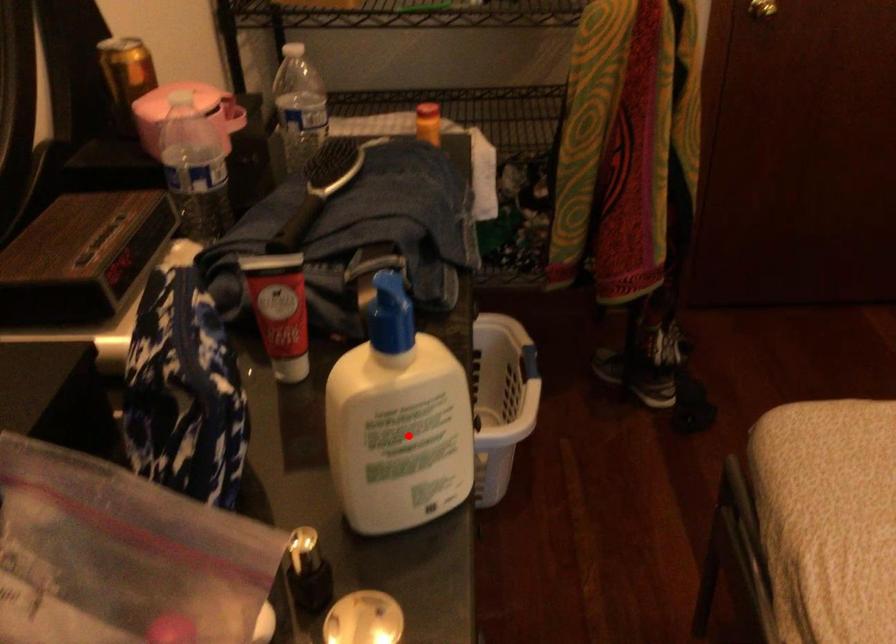
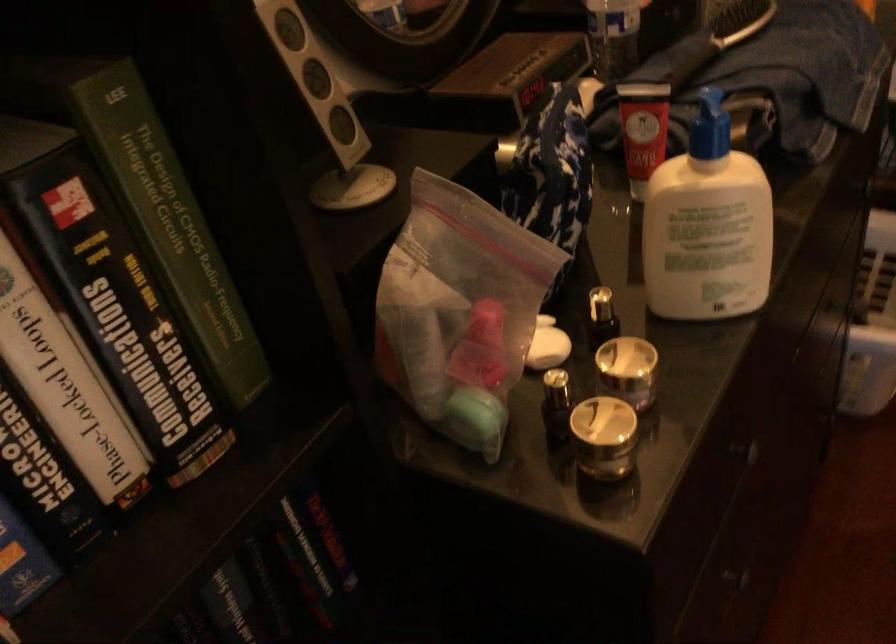
Question: I am providing you with two images of the same scene from different viewpoints. In image1, a red point is highlighted. Considering the same 3D point in image2, which of the following is correct?

Choices:
 (A) It is closer
 (B) It is farther

Answer: (B)